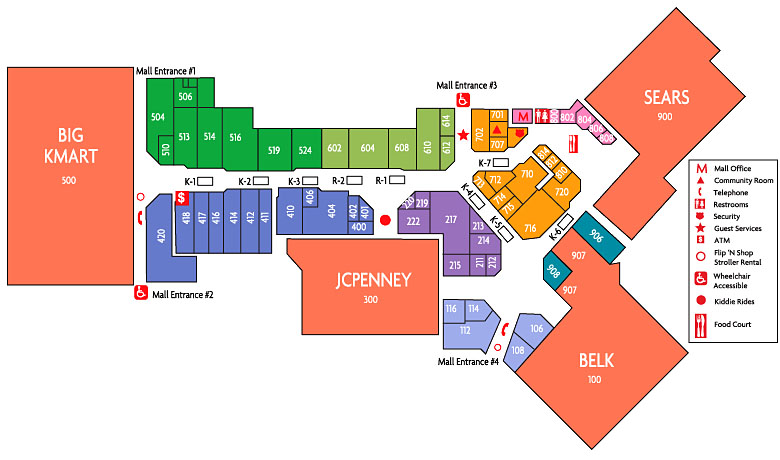
I want to click on pink room, so click(x=601, y=139), click(x=594, y=130), click(x=585, y=120), click(x=569, y=118), click(x=555, y=117), click(x=523, y=114).